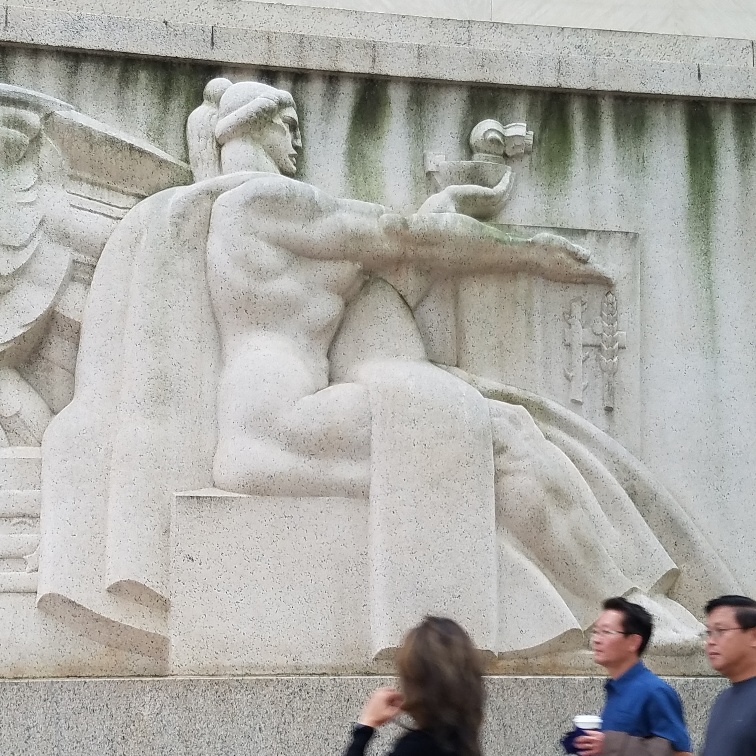
You are a GUI agent. You are given a task and a screenshot of the screen. Output one action in this format:
    pyautogui.click(x=<x>, y=<y>)
    Task: Click on the towel
    The height and width of the screenshot is (756, 756).
    Given the screenshot: What is the action you would take?
    pyautogui.click(x=453, y=496)